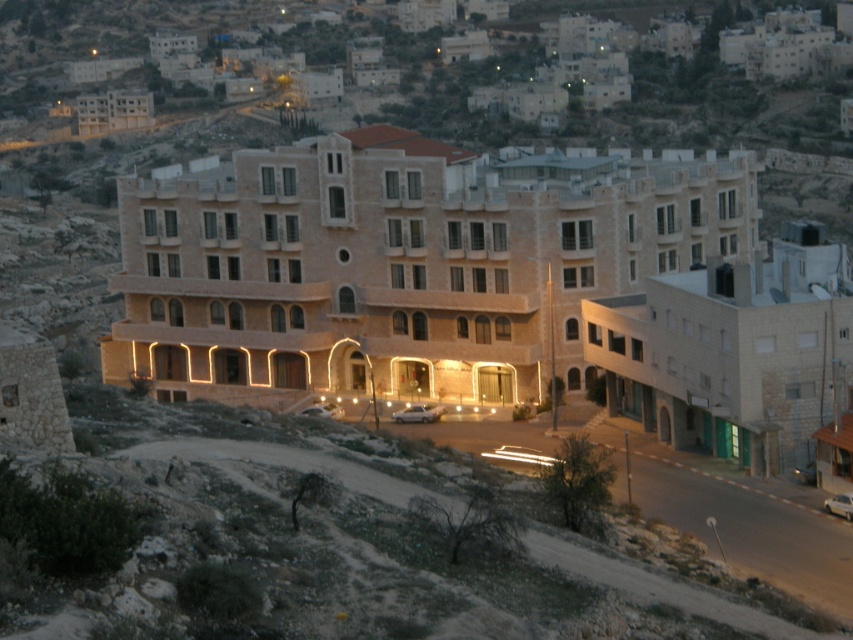
Question: Which object is farther from the camera taking this photo?

Choices:
 (A) beige stone hotel at center
 (B) beige stone building at upper center

Answer: (B)

Question: Is beige stone building at upper center closer to camera compared to beige stone building at lower right?

Choices:
 (A) no
 (B) yes

Answer: (A)

Question: Which object is positioned closest to the beige stone hotel at center?

Choices:
 (A) beige stone building at lower right
 (B) beige stone building at upper center

Answer: (A)

Question: In this image, where is beige stone building at upper center located relative to beige stone building at lower right?

Choices:
 (A) right
 (B) left

Answer: (B)

Question: Which object is the closest to the beige stone building at upper center?

Choices:
 (A) beige stone building at lower right
 (B) beige stone hotel at center

Answer: (B)

Question: From the image, what is the correct spatial relationship of beige stone hotel at center in relation to beige stone building at upper center?

Choices:
 (A) left
 (B) right

Answer: (B)